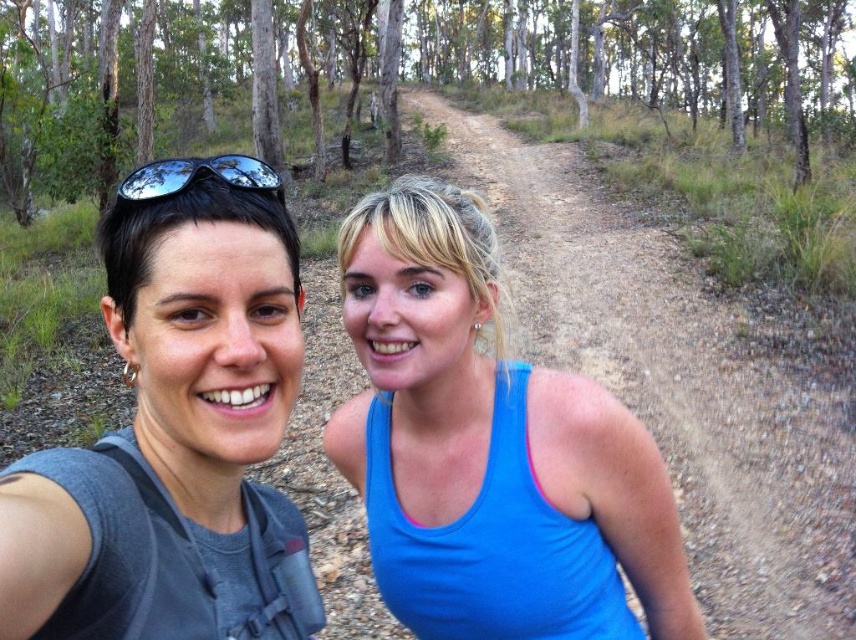
Who is lower down, blue fabric tank top at center or sunglasses at upper left?

blue fabric tank top at center

Does blue fabric tank top at center appear over sunglasses at upper left?

No, blue fabric tank top at center is not above sunglasses at upper left.

Describe the element at coordinates (489, 449) in the screenshot. I see `blue fabric tank top at center` at that location.

Image resolution: width=856 pixels, height=640 pixels. I want to click on blue fabric tank top at center, so click(x=489, y=449).

Does gray fabric tank top at left appear on the left side of green matte forest at upper center?

Incorrect, gray fabric tank top at left is not on the left side of green matte forest at upper center.

Does point (215, 452) come closer to viewer compared to point (28, 129)?

Yes, point (215, 452) is closer to viewer.

The height and width of the screenshot is (640, 856). Describe the element at coordinates (176, 429) in the screenshot. I see `gray fabric tank top at left` at that location.

Where is `gray fabric tank top at left`? gray fabric tank top at left is located at coordinates (176, 429).

Who is higher up, dirt path at center or sunglasses at upper left?

dirt path at center

Does point (703, 512) come farther from viewer compared to point (247, 186)?

Yes, it is.

Does point (849, 520) come closer to viewer compared to point (191, 168)?

No.

Where is `dirt path at center`? The height and width of the screenshot is (640, 856). dirt path at center is located at coordinates (676, 385).